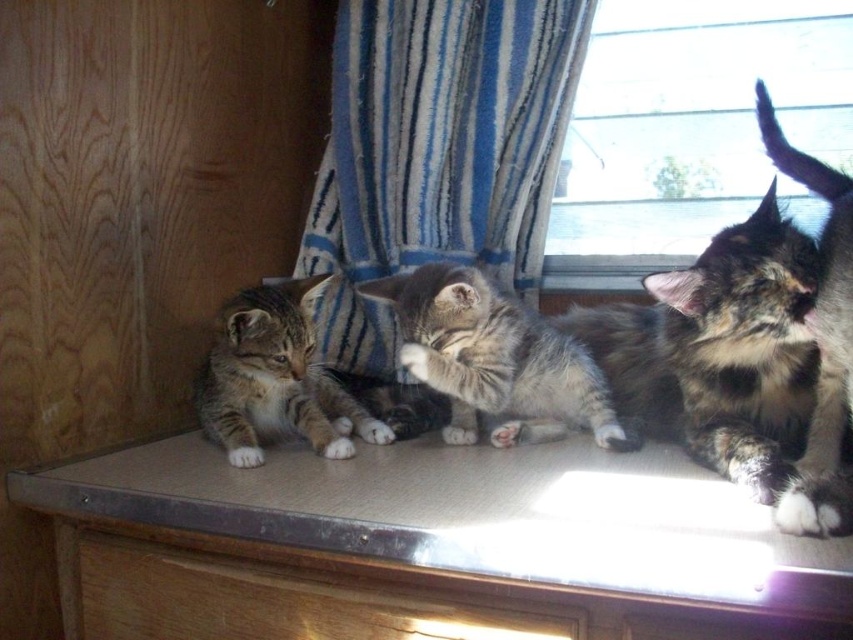
Is gray tabby kitten at center closer to the viewer compared to calico fur cat at right?

No, it is behind calico fur cat at right.

Does gray tabby kitten at center appear on the left side of calico fur cat at right?

Correct, you'll find gray tabby kitten at center to the left of calico fur cat at right.

Between point (408, 337) and point (817, 436), which one is positioned behind?

The point (408, 337) is behind.

At what (x,y) coordinates should I click in order to perform the action: click on gray tabby kitten at center. Please return your answer as a coordinate pair (x, y). Looking at the image, I should click on (494, 358).

Is striped fur kitten at left to the right of calico fur cat at right from the viewer's perspective?

No, striped fur kitten at left is not to the right of calico fur cat at right.

Does striped fur kitten at left have a smaller size compared to calico fur cat at right?

Indeed, striped fur kitten at left has a smaller size compared to calico fur cat at right.

Measure the distance between striped fur kitten at left and camera.

striped fur kitten at left is 3.56 feet away from camera.

The width and height of the screenshot is (853, 640). Find the location of `striped fur kitten at left`. striped fur kitten at left is located at coordinates (276, 378).

Can you confirm if blue striped fabric at center is positioned below striped fur kitten at left?

No.

Between point (480, 52) and point (241, 336), which one is positioned in front?

Point (241, 336) is more forward.

Is point (384, 38) positioned after point (283, 308)?

Yes.

The width and height of the screenshot is (853, 640). Find the location of `blue striped fabric at center`. blue striped fabric at center is located at coordinates (436, 150).